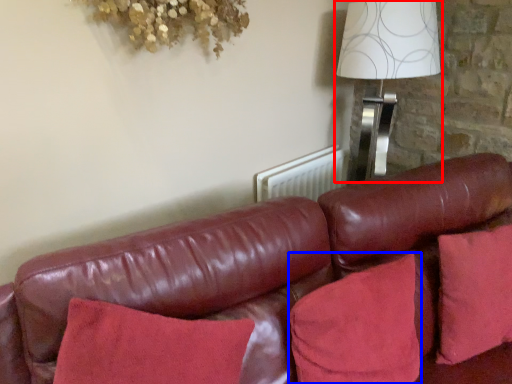
Question: Which object appears closest to the camera in this image, table lamp (highlighted by a red box) or pillow (highlighted by a blue box)?

Choices:
 (A) table lamp
 (B) pillow

Answer: (B)